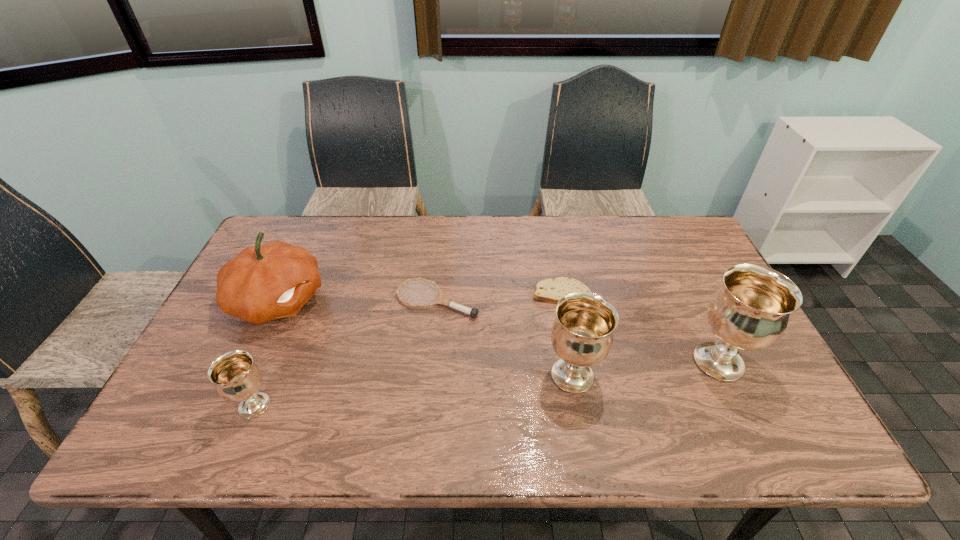
Where is `vacant space located 0.300m on the right of the tennis racket`? The height and width of the screenshot is (540, 960). vacant space located 0.300m on the right of the tennis racket is located at coordinates (583, 300).

Identify the location of vacant space situated 0.370m on the front face of the pumpkin. The height and width of the screenshot is (540, 960). (455, 301).

At what (x,y) coordinates should I click in order to perform the action: click on vacant region located on the right of the shortest object. Please return your answer as a coordinate pair (x, y). This screenshot has width=960, height=540. Looking at the image, I should click on (692, 293).

This screenshot has height=540, width=960. I want to click on chalice that is at the left edge, so click(236, 377).

Locate an element on the screen. The width and height of the screenshot is (960, 540). pumpkin at the left edge is located at coordinates (262, 283).

Find the location of a particular element. object located in the right edge section of the desktop is located at coordinates (750, 311).

Identify the location of object positioned at the near left corner. (236, 377).

Where is `object positioned at the near right corner`? This screenshot has width=960, height=540. object positioned at the near right corner is located at coordinates (750, 311).

Locate an element on the screen. The height and width of the screenshot is (540, 960). vacant space at the far edge is located at coordinates point(355,221).

Locate an element on the screen. vacant space at the near edge of the desktop is located at coordinates (371, 393).